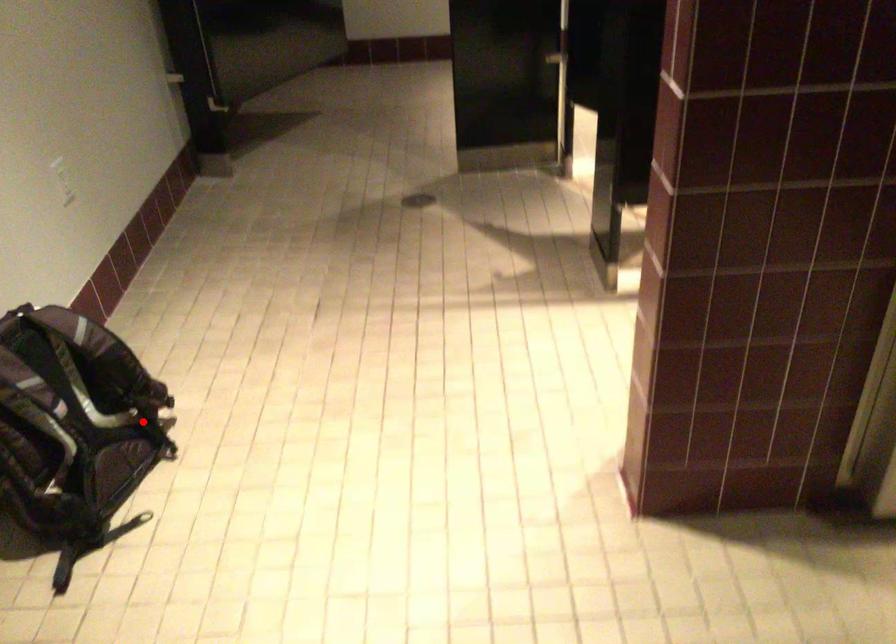
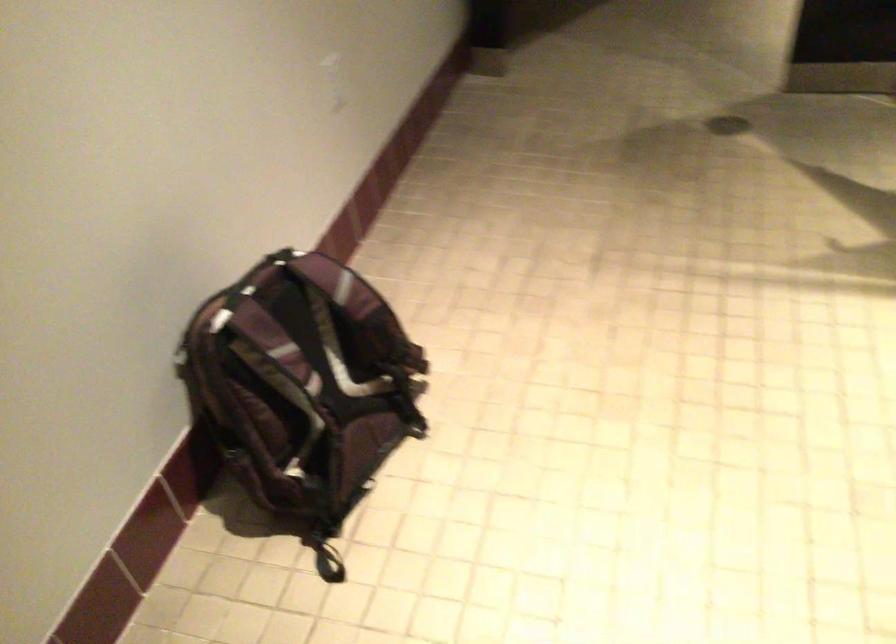
Question: I am providing you with two images of the same scene from different viewpoints. Image1 has a red point marked. In image2, the corresponding 3D location appears at what relative position? Reply with the corresponding letter.

Choices:
 (A) Closer
 (B) Farther

Answer: (A)